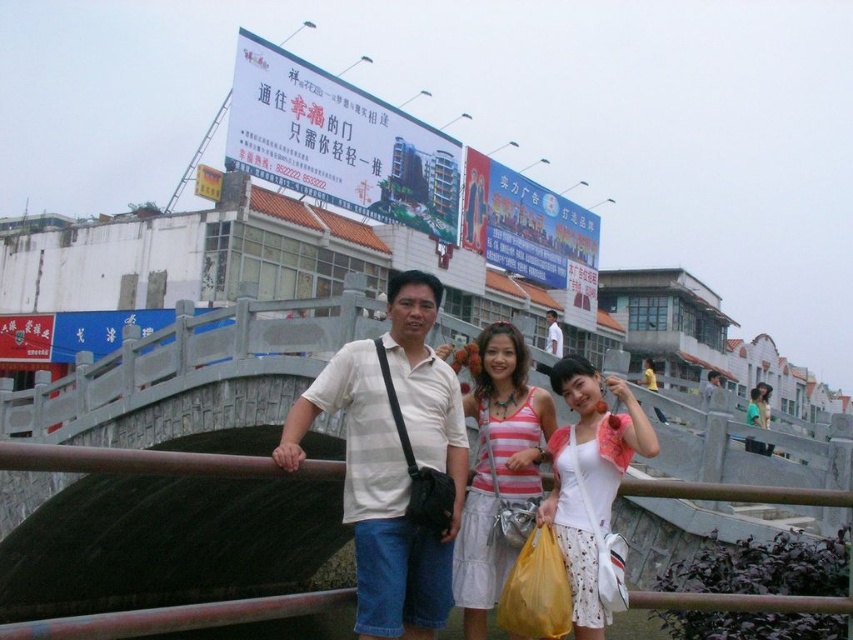
Question: Is white matte shirt at center positioned behind matte white tank top at center?

Choices:
 (A) no
 (B) yes

Answer: (B)

Question: Among these points, which one is farthest from the camera?

Choices:
 (A) (686, 600)
 (B) (750, 397)
 (C) (585, 474)
 (D) (548, 344)

Answer: (B)

Question: Estimate the real-world distances between objects in this image. Which object is farther from the matte white tank top at center?

Choices:
 (A) white fabric dress at center
 (B) striped cotton tank top at center

Answer: (B)

Question: Which point is farther to the camera?

Choices:
 (A) (753, 401)
 (B) (614, 493)

Answer: (A)

Question: Can you confirm if white striped shirt at center is smaller than white matte shirt at center?

Choices:
 (A) no
 (B) yes

Answer: (A)

Question: Can you confirm if white striped shirt at center is positioned to the right of matte white tank top at center?

Choices:
 (A) yes
 (B) no

Answer: (B)